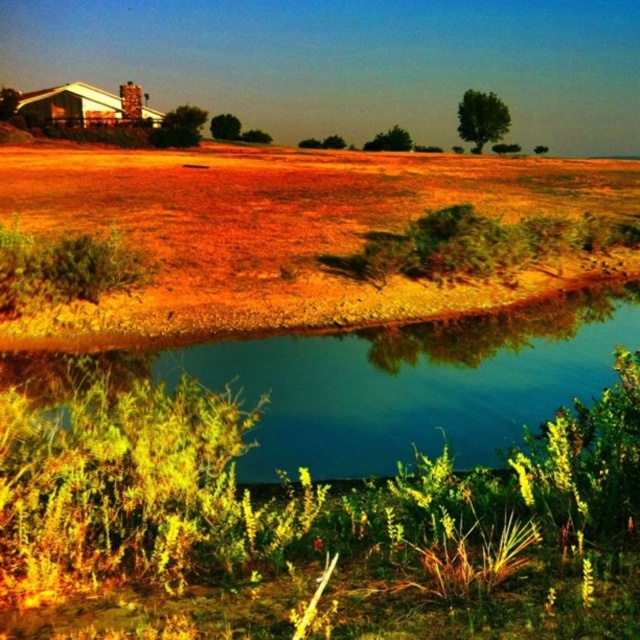
Can you confirm if dried grass at center is smaller than green reflective water at center?

No.

Is dried grass at center wider than green reflective water at center?

Correct, the width of dried grass at center exceeds that of green reflective water at center.

Measure the distance between point (620, 163) and camera.

Point (620, 163) and camera are 104.17 meters apart from each other.

At what (x,y) coordinates should I click in order to perform the action: click on dried grass at center. Please return your answer as a coordinate pair (x, y). The image size is (640, 640). Looking at the image, I should click on (288, 230).